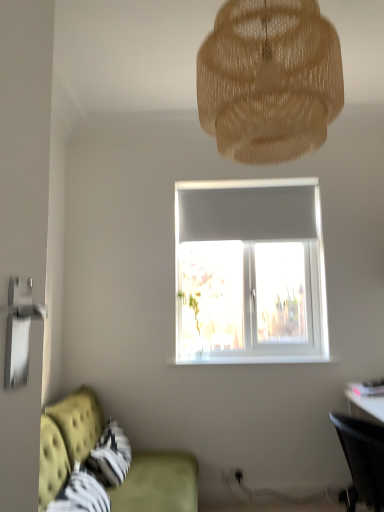
Question: From the image's perspective, is black mesh chair at lower right on top of velvet green couch at lower left?

Choices:
 (A) no
 (B) yes

Answer: (B)

Question: Does black mesh chair at lower right have a greater width compared to velvet green couch at lower left?

Choices:
 (A) no
 (B) yes

Answer: (A)

Question: Can we say black mesh chair at lower right lies outside velvet green couch at lower left?

Choices:
 (A) no
 (B) yes

Answer: (B)

Question: From a real-world perspective, is black mesh chair at lower right over velvet green couch at lower left?

Choices:
 (A) no
 (B) yes

Answer: (B)

Question: Is black mesh chair at lower right smaller than velvet green couch at lower left?

Choices:
 (A) no
 (B) yes

Answer: (B)

Question: Is translucent beige mesh at upper center wider or thinner than velvet green couch at lower left?

Choices:
 (A) wide
 (B) thin

Answer: (B)

Question: From the image's perspective, is translucent beige mesh at upper center located above or below velvet green couch at lower left?

Choices:
 (A) below
 (B) above

Answer: (B)

Question: In the image, is translucent beige mesh at upper center positioned in front of or behind velvet green couch at lower left?

Choices:
 (A) behind
 (B) front

Answer: (A)

Question: From a real-world perspective, is translucent beige mesh at upper center positioned above or below velvet green couch at lower left?

Choices:
 (A) above
 (B) below

Answer: (A)

Question: From the image's perspective, is translucent beige mesh at upper center positioned above or below black mesh chair at lower right?

Choices:
 (A) above
 (B) below

Answer: (A)

Question: From a real-world perspective, is translucent beige mesh at upper center physically located above or below black mesh chair at lower right?

Choices:
 (A) below
 (B) above

Answer: (B)

Question: Would you say translucent beige mesh at upper center is to the left or to the right of black mesh chair at lower right in the picture?

Choices:
 (A) left
 (B) right

Answer: (A)

Question: In terms of width, does translucent beige mesh at upper center look wider or thinner when compared to black mesh chair at lower right?

Choices:
 (A) thin
 (B) wide

Answer: (B)

Question: Is black mesh chair at lower right in front of or behind translucent beige mesh at upper center in the image?

Choices:
 (A) front
 (B) behind

Answer: (B)

Question: Considering the relative positions of black mesh chair at lower right and translucent beige mesh at upper center in the image provided, is black mesh chair at lower right to the left or to the right of translucent beige mesh at upper center?

Choices:
 (A) left
 (B) right

Answer: (B)